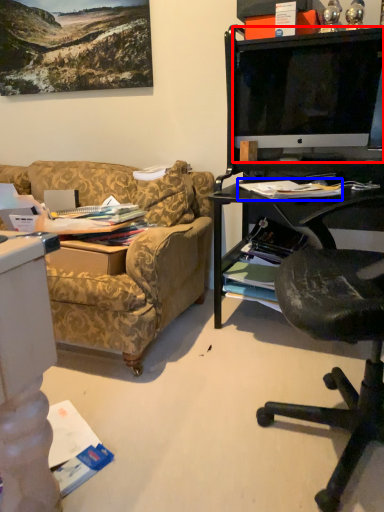
Question: Which object is further to the camera taking this photo, television (highlighted by a red box) or magazine (highlighted by a blue box)?

Choices:
 (A) television
 (B) magazine

Answer: (A)